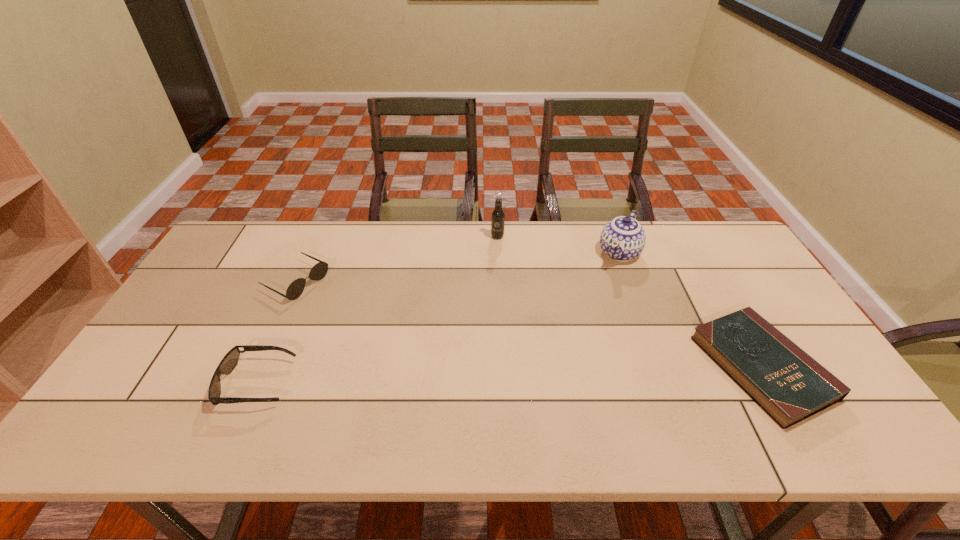
Locate an element on the screen. The height and width of the screenshot is (540, 960). free region at the far left corner of the desktop is located at coordinates (268, 248).

At what (x,y) coordinates should I click in order to perform the action: click on free location at the far right corner of the desktop. Please return your answer as a coordinate pair (x, y). Looking at the image, I should click on (713, 237).

Locate an element on the screen. The image size is (960, 540). vacant area between the root beer and the fourth tallest object is located at coordinates (377, 310).

This screenshot has height=540, width=960. What are the coordinates of `vacant point located between the root beer and the farther sunglasses` in the screenshot? It's located at (397, 259).

You are a GUI agent. You are given a task and a screenshot of the screen. Output one action in this format:
    pyautogui.click(x=<x>, y=<y>)
    Task: Click on the vacant point located between the tallest object and the farther sunglasses
    
    Given the screenshot: What is the action you would take?
    pyautogui.click(x=397, y=259)

You are a GUI agent. You are given a task and a screenshot of the screen. Output one action in this format:
    pyautogui.click(x=<x>, y=<y>)
    Task: Click on the free area in between the rightmost object and the third object from right to left
    The image size is (960, 540).
    Given the screenshot: What is the action you would take?
    pyautogui.click(x=630, y=302)

Locate an element on the screen. vacant space in between the rightmost object and the farther sunglasses is located at coordinates (529, 324).

Where is `vacant space that's between the third object from left to right and the nearer sunglasses`? The width and height of the screenshot is (960, 540). vacant space that's between the third object from left to right and the nearer sunglasses is located at coordinates (377, 310).

In order to click on empty location between the second tallest object and the rightmost object in this screenshot , I will do `click(690, 310)`.

Find the location of a particular element. The image size is (960, 540). vacant area that lies between the nearer sunglasses and the chinaware is located at coordinates (439, 318).